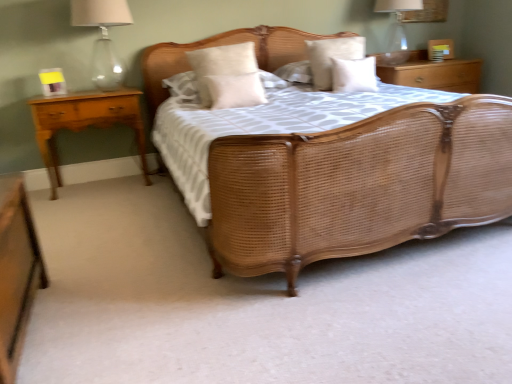
Question: In which direction should I rotate to look at beige fabric pillow at center, which appears as the 1th pillow when viewed from the left?

Choices:
 (A) right
 (B) left

Answer: (B)

Question: From the image's perspective, does matte glass lampshade at upper right, the 1th bedside lamp from the back, appear higher than wooden nightstand at upper right, positioned as the 3th nightstand in left-to-right order?

Choices:
 (A) yes
 (B) no

Answer: (A)

Question: Considering the relative sizes of matte glass lampshade at upper right, placed as the 2th bedside lamp when sorted from left to right, and wooden nightstand at upper right, the third nightstand from the front, in the image provided, is matte glass lampshade at upper right, placed as the 2th bedside lamp when sorted from left to right, taller than wooden nightstand at upper right, the third nightstand from the front,?

Choices:
 (A) yes
 (B) no

Answer: (A)

Question: Is matte glass lampshade at upper right, placed as the 2th bedside lamp when sorted from left to right, surrounding wooden nightstand at upper right, the first nightstand in the top-to-bottom sequence?

Choices:
 (A) no
 (B) yes

Answer: (A)

Question: Considering the relative positions of matte glass lampshade at upper right, the 2th bedside lamp from the front, and wooden nightstand at upper right, the third nightstand from the front, in the image provided, is matte glass lampshade at upper right, the 2th bedside lamp from the front, to the left of wooden nightstand at upper right, the third nightstand from the front, from the viewer's perspective?

Choices:
 (A) no
 (B) yes

Answer: (B)

Question: Does matte glass lampshade at upper right, the 2th bedside lamp from the front, have a larger size compared to wooden nightstand at upper right, the third nightstand from the front?

Choices:
 (A) no
 (B) yes

Answer: (A)

Question: Could you tell me if matte glass lampshade at upper right, the 1th bedside lamp from the back, is turned towards wooden nightstand at upper right, the first nightstand in the top-to-bottom sequence?

Choices:
 (A) no
 (B) yes

Answer: (A)

Question: Does beige fabric pillow at center, which is counted as the third pillow, starting from the right, have a lesser height compared to wooden nightstand at upper right, acting as the 3th nightstand starting from the bottom?

Choices:
 (A) no
 (B) yes

Answer: (B)

Question: Could wooden nightstand at upper right, the third nightstand from the front, be considered to be inside beige fabric pillow at center, which is counted as the third pillow, starting from the right?

Choices:
 (A) no
 (B) yes

Answer: (A)

Question: Is beige fabric pillow at center, which is counted as the third pillow, starting from the right, far from wooden nightstand at upper right, the first nightstand when ordered from back to front?

Choices:
 (A) no
 (B) yes

Answer: (B)

Question: Can you confirm if beige fabric pillow at center, which is counted as the third pillow, starting from the right, is positioned to the right of wooden nightstand at upper right, acting as the 3th nightstand starting from the bottom?

Choices:
 (A) yes
 (B) no

Answer: (B)

Question: Does beige fabric pillow at center, which is counted as the third pillow, starting from the right, turn towards wooden nightstand at upper right, positioned as the 3th nightstand in left-to-right order?

Choices:
 (A) yes
 (B) no

Answer: (B)

Question: Is beige fabric pillow at center, the 2th pillow from the left, completely or partially outside of wooden nightstand at upper right, positioned as the 3th nightstand in left-to-right order?

Choices:
 (A) no
 (B) yes

Answer: (B)

Question: Considering the relative positions of wooden nightstand at upper right, the first nightstand in the top-to-bottom sequence, and matte glass lamp at upper left, the 2th bedside lamp when ordered from back to front, in the image provided, is wooden nightstand at upper right, the first nightstand in the top-to-bottom sequence, behind matte glass lamp at upper left, the 2th bedside lamp when ordered from back to front,?

Choices:
 (A) yes
 (B) no

Answer: (A)